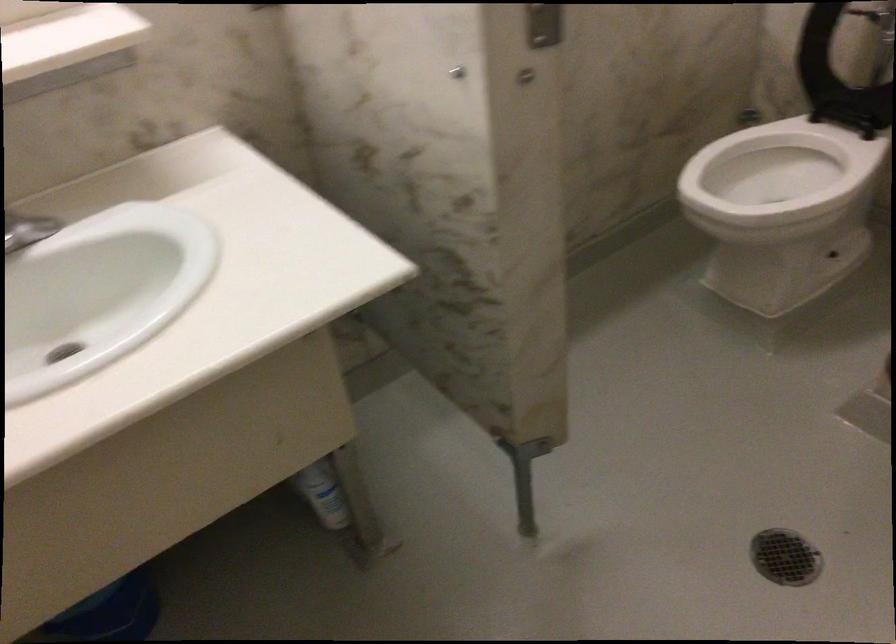
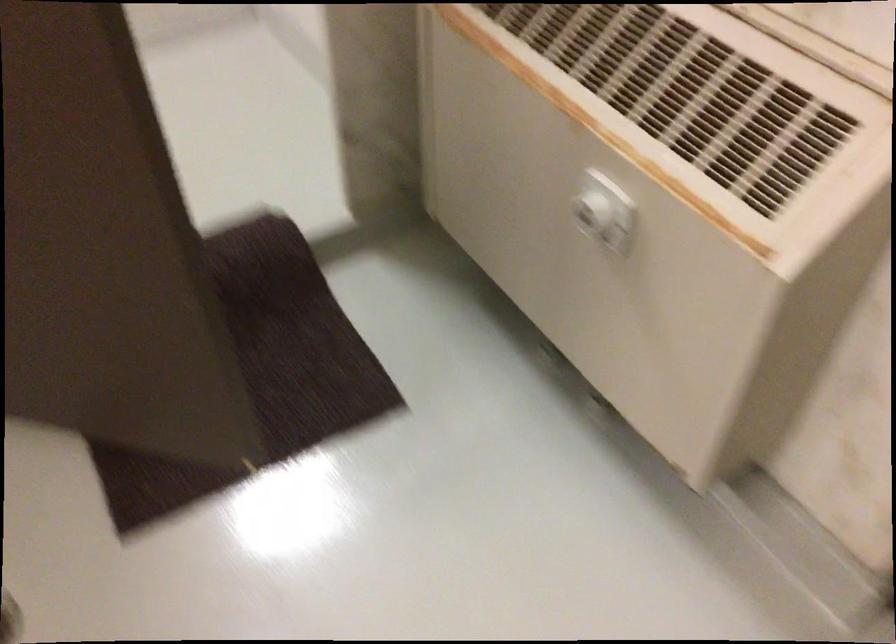
The images are taken continuously from a first-person perspective. In which direction is your viewpoint rotating?

The camera rotated toward right-down.